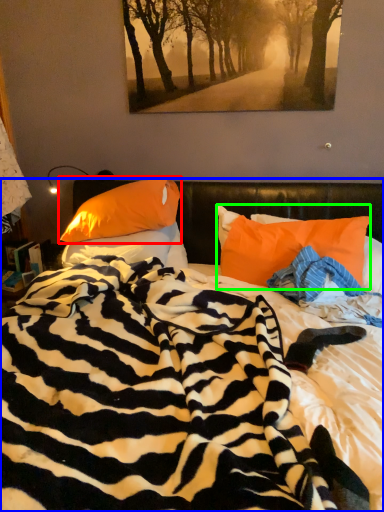
Question: Estimate the real-world distances between objects in this image. Which object is closer to pillow (highlighted by a red box), bed (highlighted by a blue box) or pillow (highlighted by a green box)?

Choices:
 (A) bed
 (B) pillow

Answer: (B)